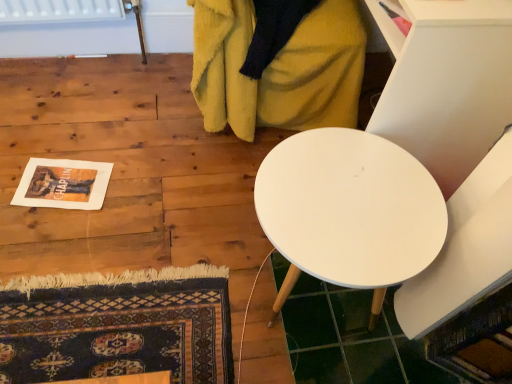
Question: Is white matte table at upper right next to soft yellow blanket at upper center?

Choices:
 (A) yes
 (B) no

Answer: (B)

Question: Is white matte table at upper right in front of soft yellow blanket at upper center?

Choices:
 (A) no
 (B) yes

Answer: (B)

Question: Is white matte table at upper right shorter than soft yellow blanket at upper center?

Choices:
 (A) yes
 (B) no

Answer: (B)

Question: From the image's perspective, does white matte table at upper right appear higher than soft yellow blanket at upper center?

Choices:
 (A) yes
 (B) no

Answer: (B)

Question: Considering the relative sizes of white matte table at upper right and soft yellow blanket at upper center in the image provided, is white matte table at upper right taller than soft yellow blanket at upper center?

Choices:
 (A) yes
 (B) no

Answer: (A)

Question: From a real-world perspective, is white matte table at upper right physically above soft yellow blanket at upper center?

Choices:
 (A) yes
 (B) no

Answer: (A)

Question: Is white matte table at upper right bigger than white matte table at center?

Choices:
 (A) no
 (B) yes

Answer: (B)

Question: Is white matte table at upper right at the left side of white matte table at center?

Choices:
 (A) yes
 (B) no

Answer: (B)

Question: From a real-world perspective, is white matte table at upper right over white matte table at center?

Choices:
 (A) yes
 (B) no

Answer: (A)

Question: Does white matte table at upper right have a greater width compared to white matte table at center?

Choices:
 (A) yes
 (B) no

Answer: (A)

Question: Is white matte table at upper right beside white matte table at center?

Choices:
 (A) no
 (B) yes

Answer: (A)

Question: Is white matte table at upper right oriented towards white matte table at center?

Choices:
 (A) yes
 (B) no

Answer: (B)

Question: From the image's perspective, would you say white matte table at center is shown under white matte table at upper right?

Choices:
 (A) no
 (B) yes

Answer: (B)